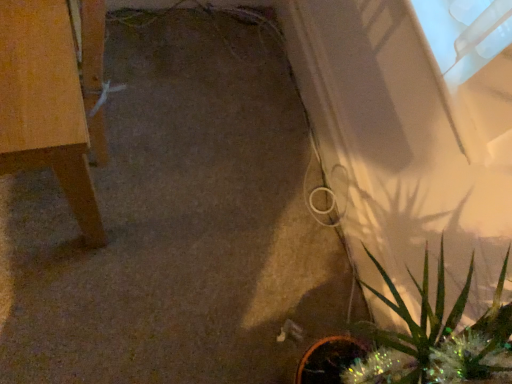
Identify the location of vacant area to the right of light brown wood table at left. The width and height of the screenshot is (512, 384). (190, 223).